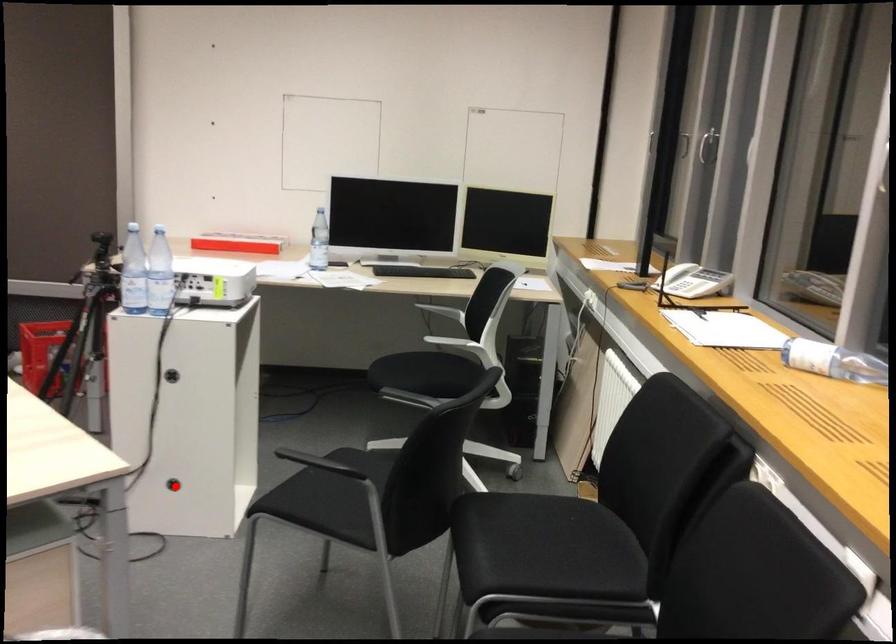
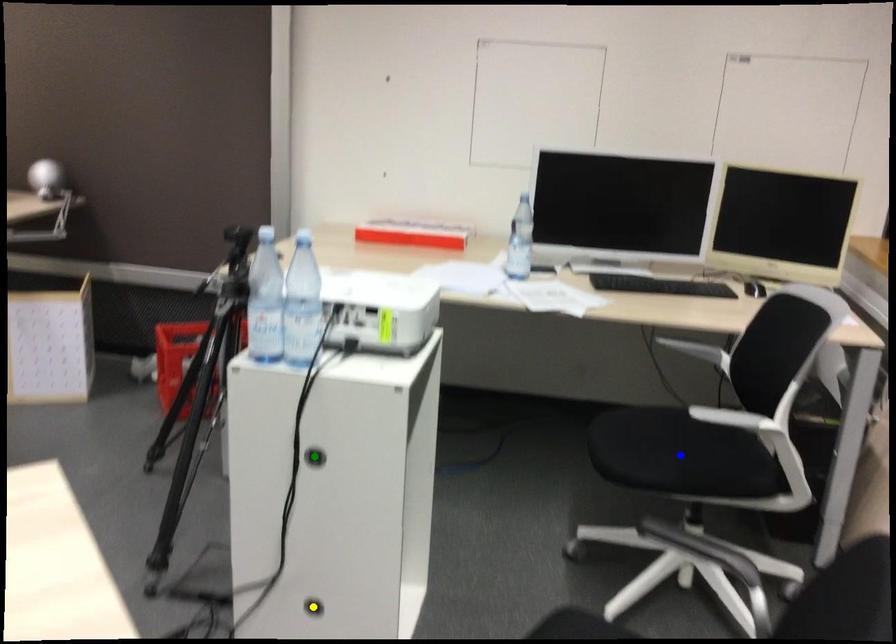
Question: I am providing you with two images of the same scene from different viewpoints. A red point is marked on the first image. You are given multiple points on the second image. In image 2, which mark is for the same physical point as the one in image 1?

Choices:
 (A) blue point
 (B) green point
 (C) yellow point

Answer: (C)